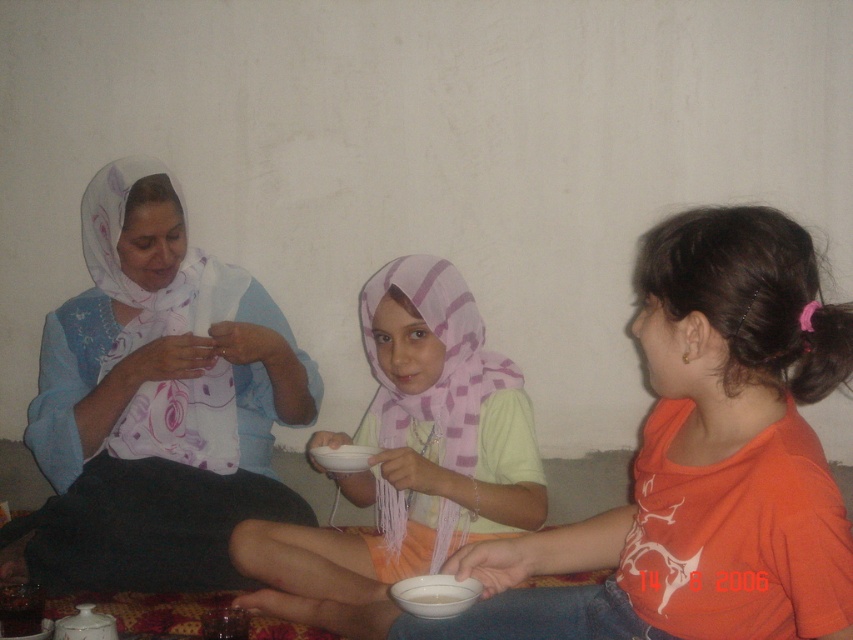
Between matte white scarf at left and white matte bowl at center, which one appears on the left side from the viewer's perspective?

From the viewer's perspective, matte white scarf at left appears more on the left side.

Does matte white scarf at left appear on the right side of white matte bowl at center?

No, matte white scarf at left is not to the right of white matte bowl at center.

Where is `matte white scarf at left`? Image resolution: width=853 pixels, height=640 pixels. matte white scarf at left is located at coordinates (155, 403).

Which is in front, point (786, 346) or point (437, 321)?

Positioned in front is point (786, 346).

Does matte pink scarf at center have a greater height compared to light green fabric hijab at center?

Incorrect, matte pink scarf at center's height is not larger of light green fabric hijab at center's.

Is point (753, 451) farther from viewer compared to point (270, 579)?

No.

The width and height of the screenshot is (853, 640). In order to click on matte pink scarf at center in this screenshot , I will do `click(701, 461)`.

Between matte pink scarf at center and matte white scarf at left, which one is positioned higher?

matte white scarf at left is above.

Is matte pink scarf at center closer to camera compared to matte white scarf at left?

Yes.

In order to click on matte pink scarf at center in this screenshot , I will do `click(701, 461)`.

This screenshot has width=853, height=640. In order to click on matte pink scarf at center in this screenshot , I will do `click(701, 461)`.